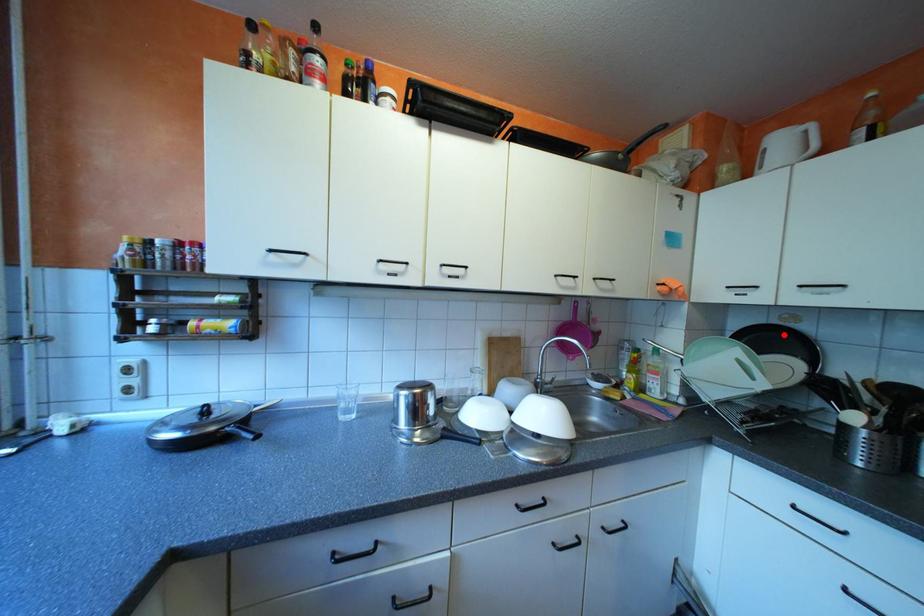
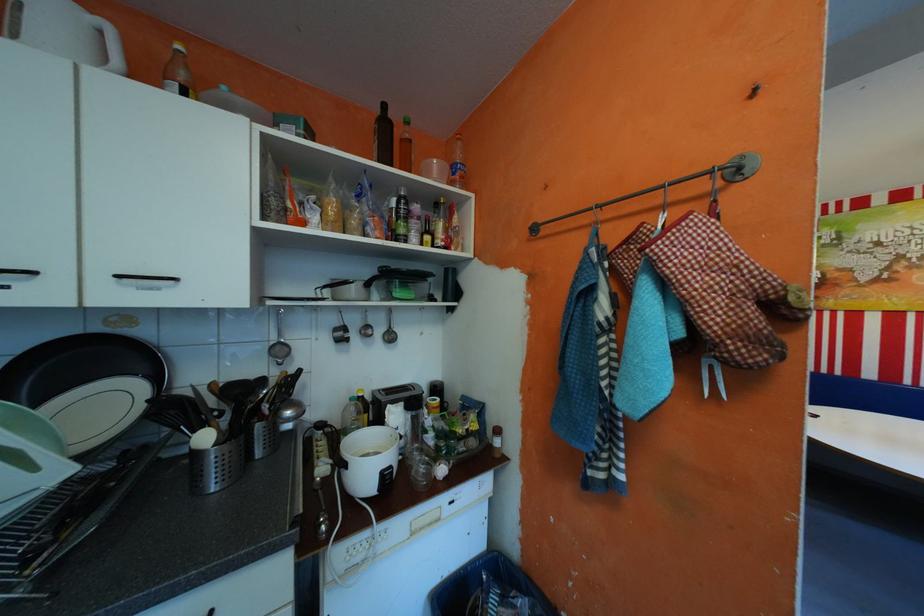
Find the pixel in the second image that matches the highlighted location in the first image.

(105, 353)